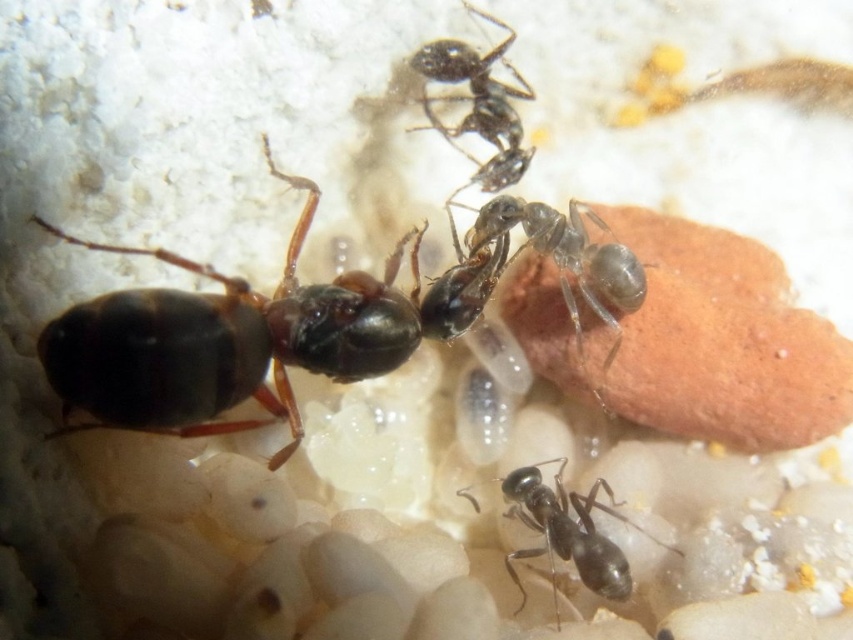
Is point (601, 307) closer to viewer compared to point (495, 147)?

Yes, it is in front of point (495, 147).

What do you see at coordinates (566, 260) in the screenshot? This screenshot has width=853, height=640. I see `translucent gray ant at center` at bounding box center [566, 260].

Is point (479, 248) more distant than point (512, 173)?

No.

Locate an element on the screen. translucent gray ant at center is located at coordinates (566, 260).

Which is below, black glossy ant at center or black glossy ant at upper center?

black glossy ant at center is below.

Which is in front, point (590, 493) or point (467, 8)?

Positioned in front is point (590, 493).

I want to click on black glossy ant at center, so click(x=567, y=532).

Between translucent gray ant at center and black glossy ant at center, which one is positioned lower?

Positioned lower is black glossy ant at center.

Where is `translucent gray ant at center`? This screenshot has height=640, width=853. translucent gray ant at center is located at coordinates click(566, 260).